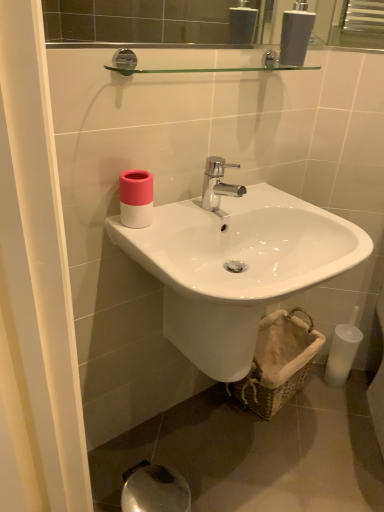
Question: Is white glossy sink at center not inside white glossy soap dispenser at upper center?

Choices:
 (A) no
 (B) yes

Answer: (B)

Question: Does white glossy sink at center appear on the right side of white glossy soap dispenser at upper center?

Choices:
 (A) no
 (B) yes

Answer: (A)

Question: Would you say white glossy soap dispenser at upper center is part of white glossy sink at center's contents?

Choices:
 (A) yes
 (B) no

Answer: (B)

Question: Considering the relative sizes of white glossy sink at center and white glossy soap dispenser at upper center in the image provided, is white glossy sink at center bigger than white glossy soap dispenser at upper center?

Choices:
 (A) no
 (B) yes

Answer: (B)

Question: Does white glossy sink at center lie in front of white glossy soap dispenser at upper center?

Choices:
 (A) yes
 (B) no

Answer: (A)

Question: Considering their positions, is white glossy sink at center located in front of or behind pink matte cup at upper left?

Choices:
 (A) behind
 (B) front

Answer: (B)

Question: Is point (109, 236) closer or farther from the camera than point (145, 188)?

Choices:
 (A) farther
 (B) closer

Answer: (A)

Question: From a real-world perspective, is white glossy sink at center above or below pink matte cup at upper left?

Choices:
 (A) below
 (B) above

Answer: (A)

Question: From the image's perspective, is white glossy sink at center located above or below pink matte cup at upper left?

Choices:
 (A) below
 (B) above

Answer: (A)

Question: From a real-world perspective, is brown woven basket at lower right above or below pink matte cup at upper left?

Choices:
 (A) above
 (B) below

Answer: (B)

Question: From their relative heights in the image, would you say brown woven basket at lower right is taller or shorter than pink matte cup at upper left?

Choices:
 (A) tall
 (B) short

Answer: (A)

Question: Is brown woven basket at lower right bigger or smaller than pink matte cup at upper left?

Choices:
 (A) small
 (B) big

Answer: (B)

Question: Considering the positions of point (264, 376) and point (130, 169), is point (264, 376) closer or farther from the camera than point (130, 169)?

Choices:
 (A) farther
 (B) closer

Answer: (A)

Question: Is brown woven basket at lower right inside or outside of white glossy soap dispenser at upper center?

Choices:
 (A) outside
 (B) inside

Answer: (A)

Question: Considering the positions of point (274, 335) and point (294, 60), is point (274, 335) closer or farther from the camera than point (294, 60)?

Choices:
 (A) closer
 (B) farther

Answer: (B)